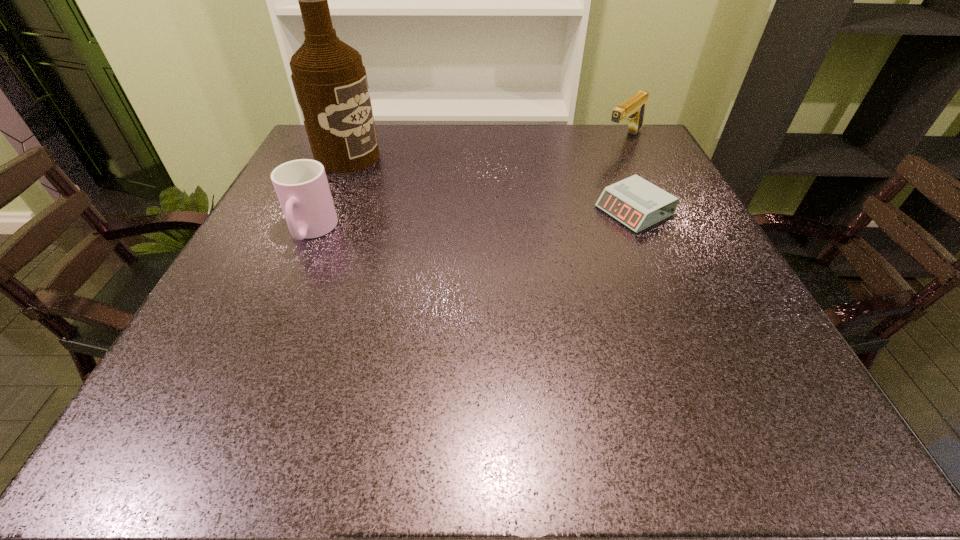
In order to click on vacant spot on the desktop that is between the cup and the alarm clock and is positioned at the barrel of the pistol in this screenshot , I will do 525,218.

Locate an element on the screen. The height and width of the screenshot is (540, 960). free space on the desktop that is between the cup and the alarm clock and is positioned on the label of the alcohol is located at coordinates tap(499, 220).